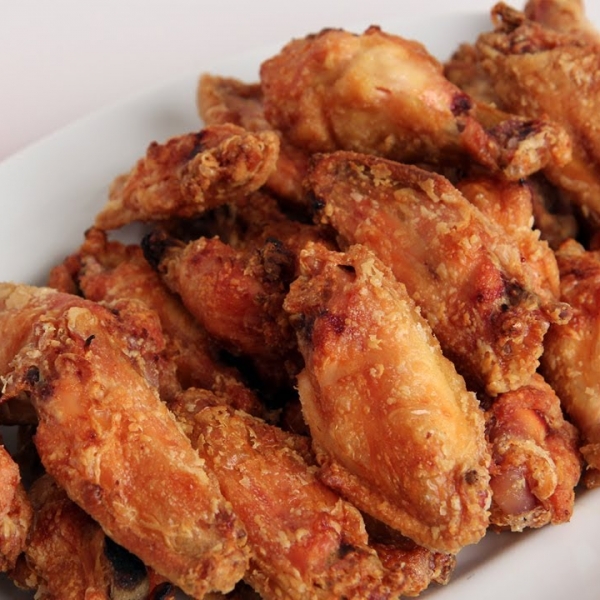
The image size is (600, 600). I want to click on edge of plate, so click(x=38, y=140).